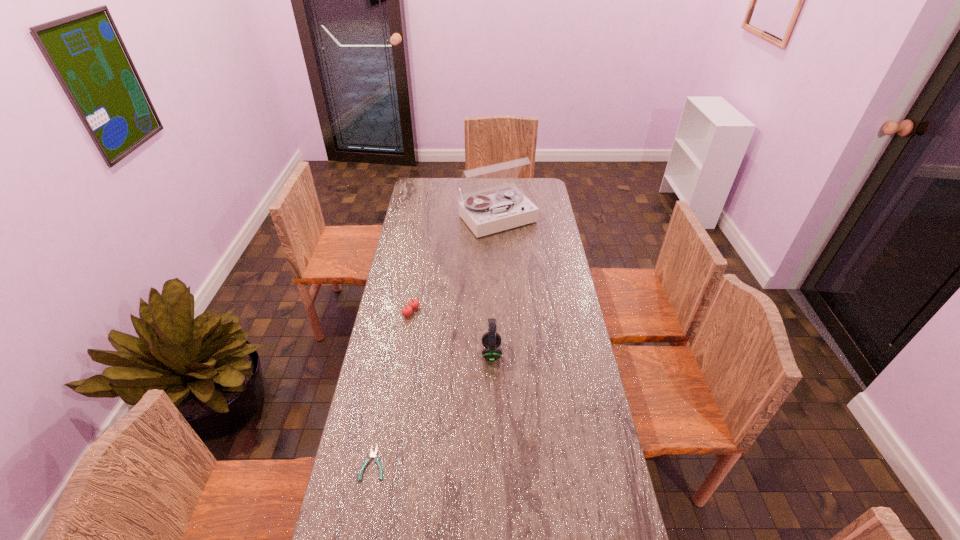
At what (x,y) coordinates should I click in order to perform the action: click on free space at the right edge of the desktop. Please return your answer as a coordinate pair (x, y). Looking at the image, I should click on (557, 264).

Locate an element on the screen. This screenshot has width=960, height=540. free space at the far left corner of the desktop is located at coordinates (419, 178).

In the image, there is a desktop. Where is `vacant space at the far right corner`? vacant space at the far right corner is located at coordinates pyautogui.click(x=533, y=197).

In order to click on free spot between the second nearest object and the shortest object in this screenshot , I will do `click(433, 408)`.

You are a GUI agent. You are given a task and a screenshot of the screen. Output one action in this format:
    pyautogui.click(x=<x>, y=<y>)
    Task: Click on the free space between the third farthest object and the cherry
    
    Given the screenshot: What is the action you would take?
    pyautogui.click(x=451, y=332)

This screenshot has width=960, height=540. In order to click on free space between the shortest object and the cherry in this screenshot , I will do `click(393, 387)`.

This screenshot has width=960, height=540. Find the location of `unoccupied position between the farthest object and the nearest object`. unoccupied position between the farthest object and the nearest object is located at coordinates (435, 340).

At what (x,y) coordinates should I click in order to perform the action: click on vacant area that lies between the cherry and the third shortest object. Please return your answer as a coordinate pair (x, y). Looking at the image, I should click on (451, 332).

Where is `free space between the cherry and the pliers`? This screenshot has height=540, width=960. free space between the cherry and the pliers is located at coordinates (393, 387).

This screenshot has height=540, width=960. Find the location of `free space that is in between the headset and the tallest object`. free space that is in between the headset and the tallest object is located at coordinates (493, 285).